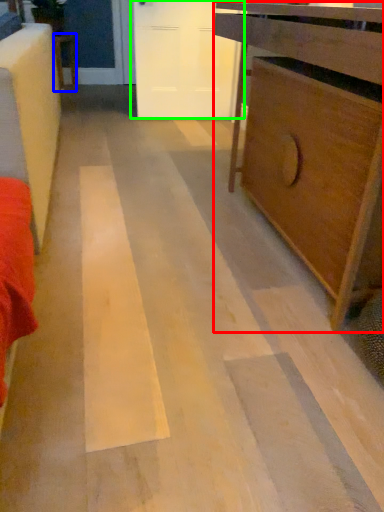
Question: Based on their relative distances, which object is farther from chest of drawers (highlighted by a red box)? Choose from furniture (highlighted by a blue box) and door (highlighted by a green box).

Choices:
 (A) furniture
 (B) door

Answer: (A)